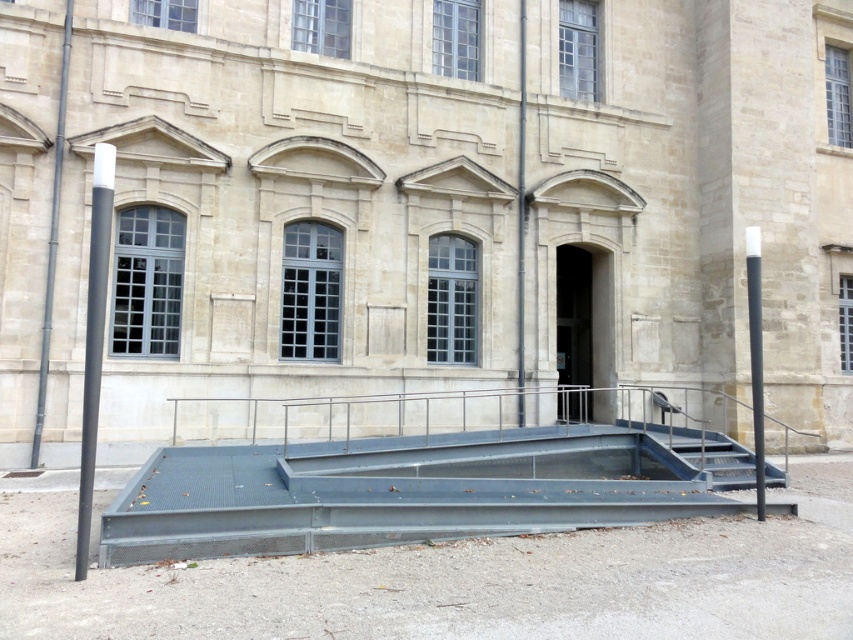
You are standing at the entrance of the building and want to locate the matte black pole at left. Which direction should you face to see it?

The matte black pole at left is located at point coordinates (94, 339), so you should face the left side of the building to see it.

You are a delivery person with a cart that is 10 feet wide. You need to navigate through the space between the metallic gray stairs at center and the black matte pole at right. Can your cart fit through the gap between them?

The metallic gray stairs at center and the black matte pole at right are 11.56 feet apart from each other. Since your cart is 10 feet wide, it can fit through the gap between them as there is enough space.

You are a delivery person trying to park your 1.2 meter wide delivery cart between the matte black pole at left and the metallic gray pole at left. Can you fit your cart there?

The matte black pole at left is narrower than the metallic gray pole at left, but the distance between them isn t specified. Without knowing the space between the poles, it s impossible to determine if the cart will fit.